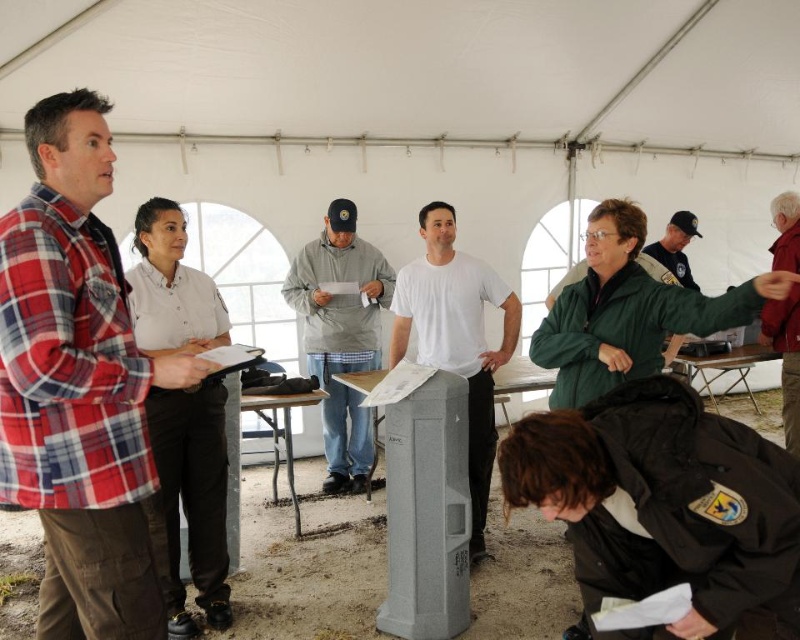
You are standing at the origin point of the coordinate system in the image. The white shirt at left is located at a specific coordinate. Can you tell me what the coordinates are?

The coordinates of the white shirt at left are at point (192, 499).

Based on the scene description, which person is shorter between the plaid flannel shirt at left and the white shirt at left?

The plaid flannel shirt at left is shorter than the white shirt at left.